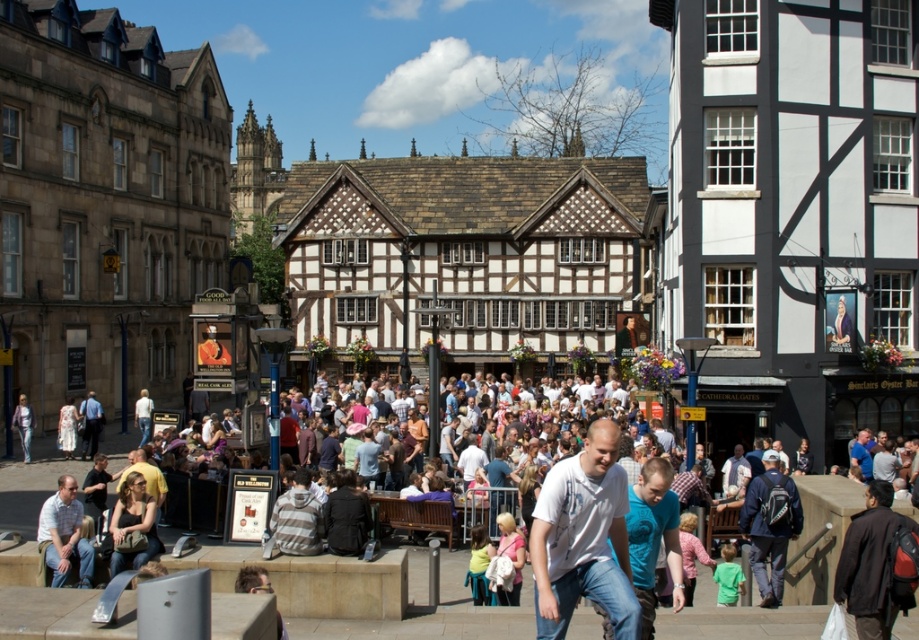
Question: Among these objects, which one is nearest to the camera?

Choices:
 (A) multicolored casual attire at center
 (B) dark brown leather jacket at lower right
 (C) white t-shirt at center

Answer: (C)

Question: Estimate the real-world distances between objects in this image. Which object is farther from the multicolored casual attire at center?

Choices:
 (A) striped hoodie at center
 (B) dark blue backpack at center
 (C) dark brown leather jacket at lower right

Answer: (C)

Question: In this image, where is multicolored casual attire at center located relative to white t-shirt at center?

Choices:
 (A) left
 (B) right

Answer: (A)

Question: Among these objects, which one is farthest from the camera?

Choices:
 (A) striped hoodie at center
 (B) white t-shirt at center
 (C) multicolored casual attire at center

Answer: (A)

Question: Does multicolored casual attire at center appear over dark blue backpack at center?

Choices:
 (A) yes
 (B) no

Answer: (A)

Question: Is multicolored casual attire at center above dark blue backpack at center?

Choices:
 (A) yes
 (B) no

Answer: (A)